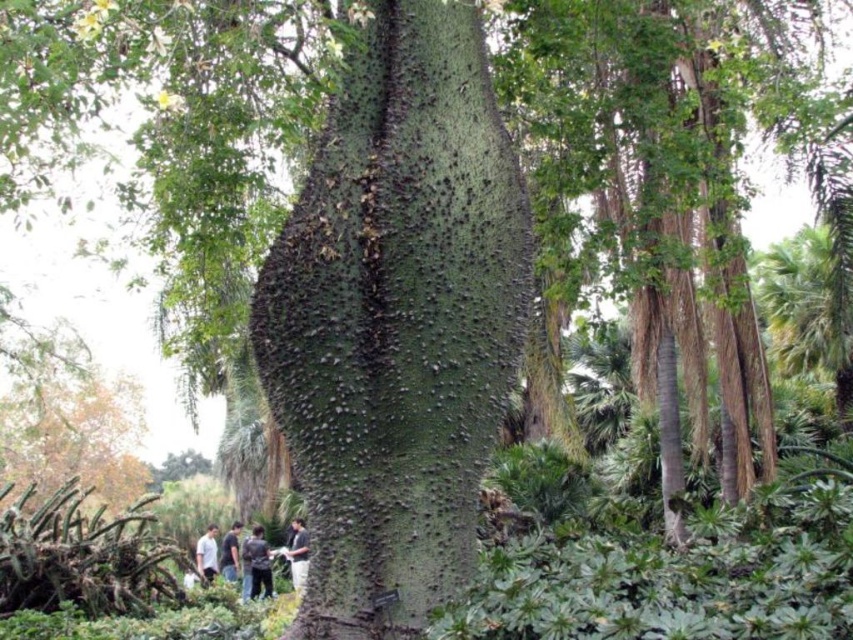
Does point (294, 557) come closer to viewer compared to point (200, 538)?

Yes, it is in front of point (200, 538).

Is dark gray textured shirt at lower center taller than white cotton shirt at lower left?

Correct, dark gray textured shirt at lower center is much taller as white cotton shirt at lower left.

Where is `dark gray textured shirt at lower center`? The width and height of the screenshot is (853, 640). dark gray textured shirt at lower center is located at coordinates (297, 554).

Is point (329, 332) more distant than point (235, 545)?

No, (329, 332) is closer to viewer.

Does green rough bark tree trunk at center appear on the left side of dark gray shirt at lower left?

Incorrect, green rough bark tree trunk at center is not on the left side of dark gray shirt at lower left.

Is point (434, 595) positioned behind point (229, 548)?

No, (434, 595) is in front of (229, 548).

At what (x,y) coordinates should I click in order to perform the action: click on green rough bark tree trunk at center. Please return your answer as a coordinate pair (x, y). Looking at the image, I should click on (396, 320).

Is green rough bark tree trunk at center thinner than dark gray shirt at lower center?

No.

Does green rough bark tree trunk at center have a larger size compared to dark gray shirt at lower center?

Indeed, green rough bark tree trunk at center has a larger size compared to dark gray shirt at lower center.

Describe the element at coordinates (396, 320) in the screenshot. The image size is (853, 640). I see `green rough bark tree trunk at center` at that location.

In order to click on green rough bark tree trunk at center in this screenshot , I will do `click(396, 320)`.